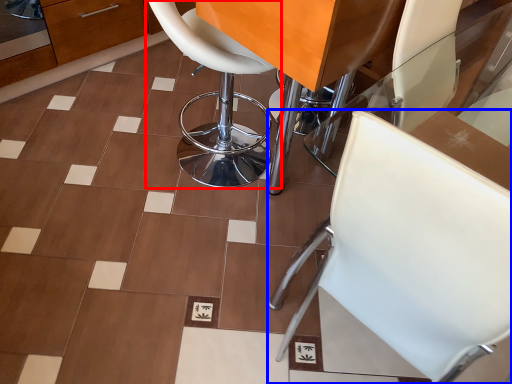
Question: Which point is further to the camera, chair (highlighted by a red box) or chair (highlighted by a blue box)?

Choices:
 (A) chair
 (B) chair

Answer: (A)